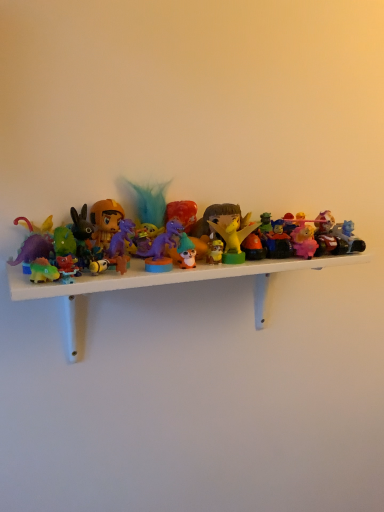
Question: From a real-world perspective, is matte orange helmet at left, which ranks as the eighth toy in right-to-left order, above or below pink matte figurine at center-right, the 7th toy when ordered from left to right?

Choices:
 (A) above
 (B) below

Answer: (A)

Question: Considering the positions of point (120, 218) and point (296, 238), is point (120, 218) closer or farther from the camera than point (296, 238)?

Choices:
 (A) closer
 (B) farther

Answer: (A)

Question: Estimate the real-world distances between objects in this image. Which object is closer to the matte orange helmet at left, which ranks as the eighth toy in right-to-left order?

Choices:
 (A) translucent plastic car at right, which is the first toy in right-to-left order
 (B) rubber car at center, marked as the 3th toy in a right-to-left arrangement
 (C) matte orange figurine at center, which ranks as the fifth toy in right-to-left order
 (D) matte yellow dragon at center, positioned as the 4th toy in right-to-left order
 (E) plastic toys at center

Answer: (C)

Question: Considering the real-world distances, which object is farthest from the rubber car at center, which is the 6th toy in left-to-right order?

Choices:
 (A) purple plastic dinosaur at center, which appears as the sixth toy when viewed from the right
 (B) matte yellow dragon at center, the 5th toy from the left
 (C) matte orange figurine at center, which ranks as the 4th toy in left-to-right order
 (D) matte orange helmet at left, the 1th toy from the left
 (E) purple plastic dinosaur at center, the 7th toy viewed from the right

Answer: (D)